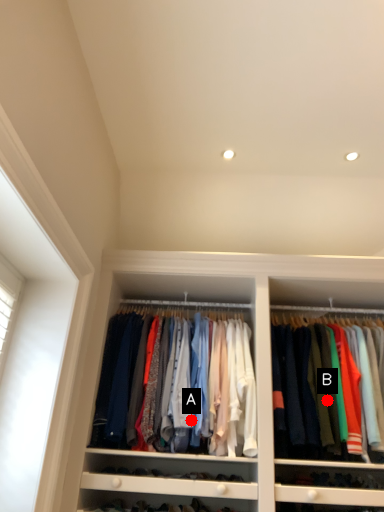
Question: Two points are circled on the image, labeled by A and B beside each circle. Which of the following is the closest to the observer?

Choices:
 (A) A is closer
 (B) B is closer

Answer: (A)